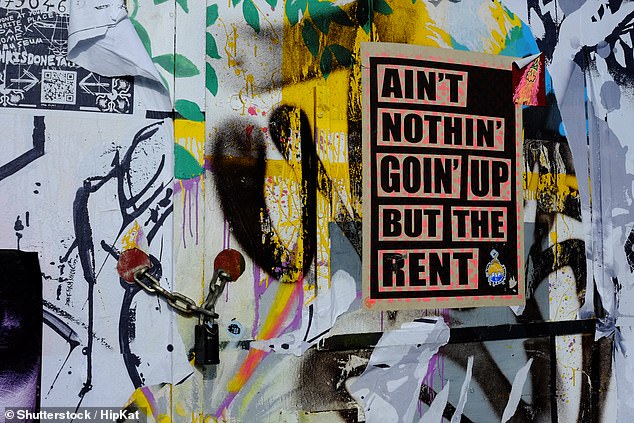
Identify the location of posters. This screenshot has height=423, width=634. (429, 50), (44, 27), (10, 289).